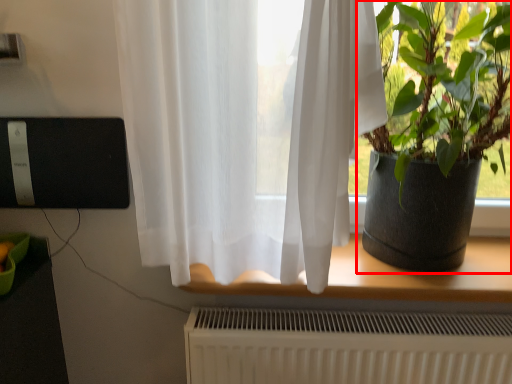
Question: From the image's perspective, where is houseplant (annotated by the red box) located relative to window?

Choices:
 (A) above
 (B) below

Answer: (A)